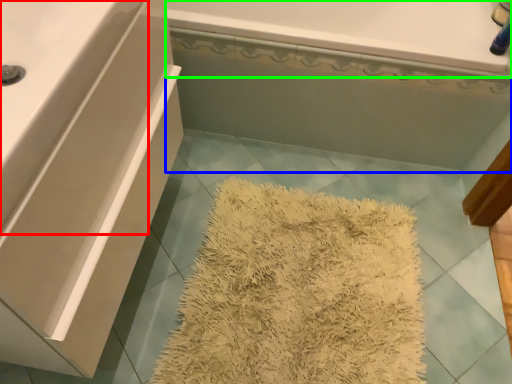
Question: Which is nearer to the counter top (highlighted by a red box)? bath (highlighted by a blue box) or bath (highlighted by a green box).

Choices:
 (A) bath
 (B) bath

Answer: (B)